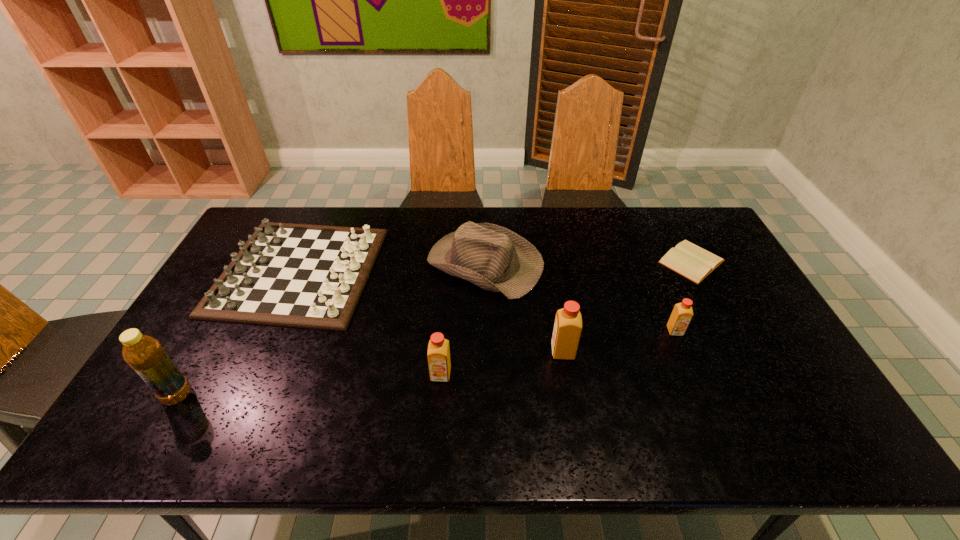
Locate an element on the screen. free spot between the shortest orange juice and the sixth shortest object is located at coordinates pos(619,341).

The image size is (960, 540). Find the location of `free spot between the fifth farthest object and the rightmost object`. free spot between the fifth farthest object and the rightmost object is located at coordinates (627, 307).

What are the coordinates of `unoccupied position between the tallest object and the leftmost orange juice` in the screenshot? It's located at (309, 385).

Identify the location of object that ranks as the sixth closest to the diary. 143,353.

Select which object is the sixth closest to the rightmost orange juice. Please provide its 2D coordinates. Your answer should be formatted as a tuple, i.e. [(x, y)], where the tuple contains the x and y coordinates of a point satisfying the conditions above.

[(143, 353)]

Locate which orange juice ranks second in proximity to the diary. Please provide its 2D coordinates. Your answer should be formatted as a tuple, i.e. [(x, y)], where the tuple contains the x and y coordinates of a point satisfying the conditions above.

[(568, 326)]

Select which orange juice appears as the second closest to the rightmost orange juice. Please provide its 2D coordinates. Your answer should be formatted as a tuple, i.e. [(x, y)], where the tuple contains the x and y coordinates of a point satisfying the conditions above.

[(438, 349)]

You are a GUI agent. You are given a task and a screenshot of the screen. Output one action in this format:
    pyautogui.click(x=<x>, y=<y>)
    Task: Click on the free space that satisfies the following two spatial constraints: 1. on the back side of the sixth tallest object; 2. on the left side of the shortest object
    The image size is (960, 540).
    Given the screenshot: What is the action you would take?
    pyautogui.click(x=303, y=261)